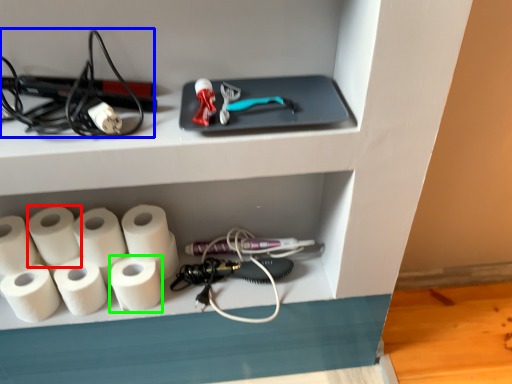
Question: Which is nearer to the paper towel (highlighted by a red box)? equipment (highlighted by a blue box) or paper towel (highlighted by a green box).

Choices:
 (A) equipment
 (B) paper towel

Answer: (B)